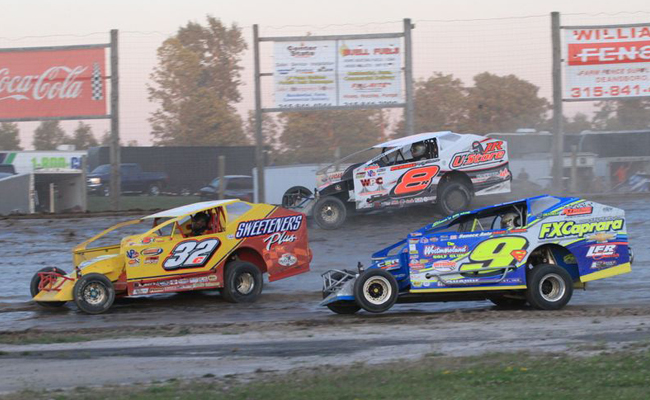
Where is `surface`? surface is located at coordinates (16, 259).